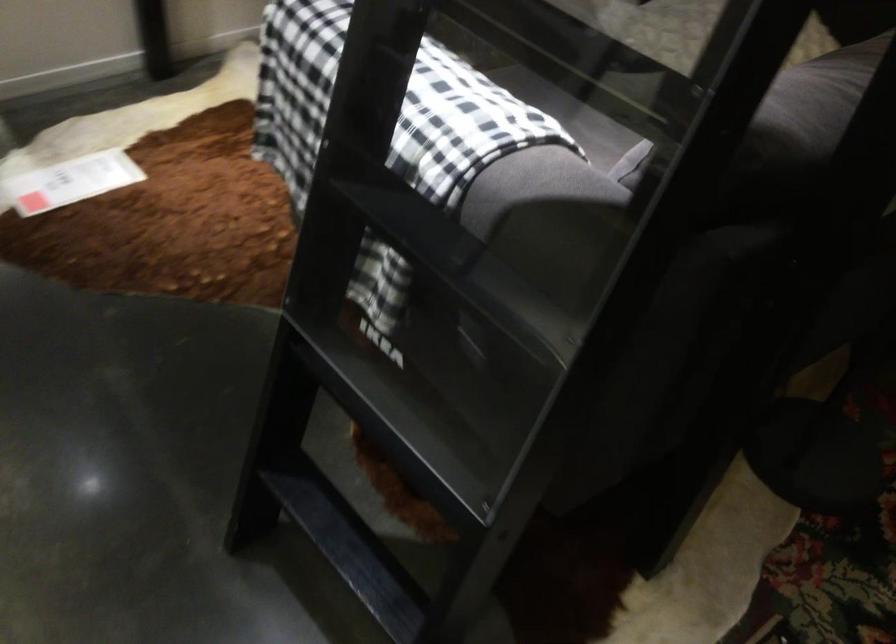
Find the location of `sofa armrest`. sofa armrest is located at coordinates (384, 107).